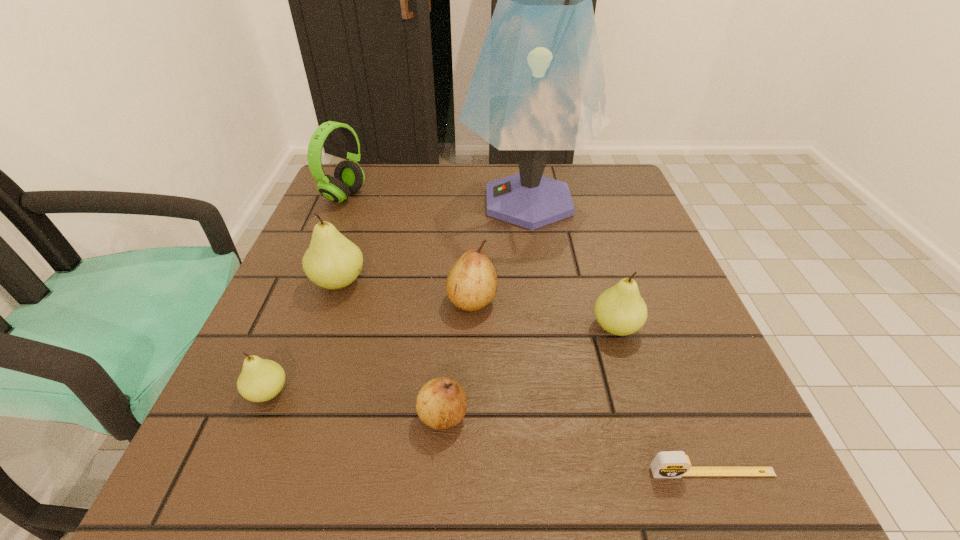
The width and height of the screenshot is (960, 540). In order to click on free space located 0.080m on the left of the smaller brown pear in this screenshot , I will do `click(365, 415)`.

Image resolution: width=960 pixels, height=540 pixels. In order to click on lampshade present at the far edge in this screenshot , I will do `click(539, 85)`.

Locate an element on the screen. This screenshot has height=540, width=960. headset that is at the far edge is located at coordinates [349, 177].

Where is `object located at the near edge`? The width and height of the screenshot is (960, 540). object located at the near edge is located at coordinates (667, 464).

Find the location of `headset present at the left edge`. headset present at the left edge is located at coordinates (349, 177).

You are a GUI agent. You are given a task and a screenshot of the screen. Output one action in this format:
    pyautogui.click(x=<x>, y=<y>)
    Task: Click on the lampshade that is at the right edge
    The image size is (960, 540).
    Given the screenshot: What is the action you would take?
    pyautogui.click(x=539, y=85)

Image resolution: width=960 pixels, height=540 pixels. I want to click on pear situated at the right edge, so click(x=620, y=310).

What are the coordinates of `tape measure located at the right edge` in the screenshot? It's located at (667, 464).

Find the location of `object at the far left corner`. object at the far left corner is located at coordinates (349, 177).

Find the location of a particular element. The image size is (960, 540). object that is at the far right corner is located at coordinates (539, 85).